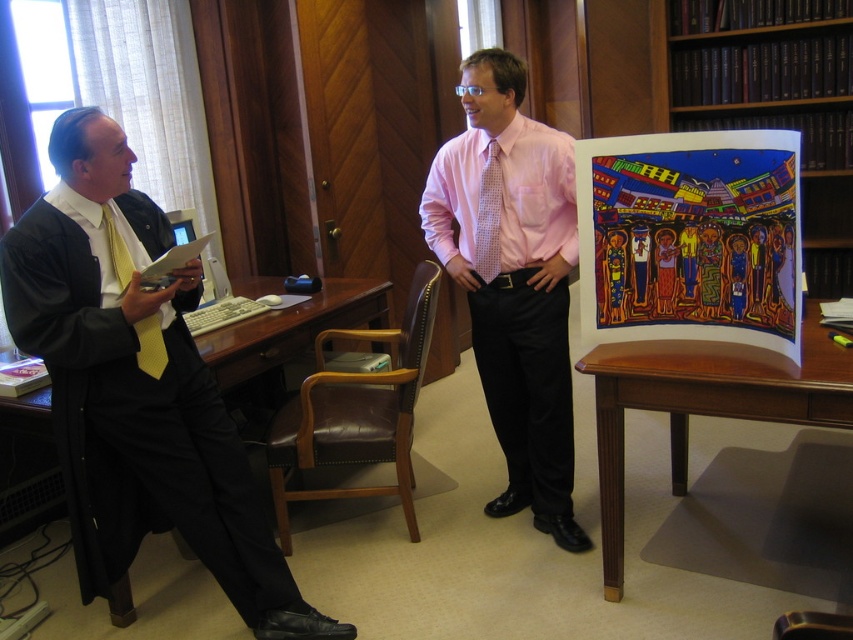
You are a photographer trying to capture a photo of both the seated man and the artwork. You want to ensure that both subjects are in focus. Given the positions of point 1 at coordinates point (827, 394) and point 2 at coordinates point (497, 140), which point should you focus on to achieve this?

You should focus on point (827, 394) because it is closer to the viewer than point (497, 140), ensuring both subjects are within the depth of field.

You are standing in the office scene and want to reach the point marked as point (100, 458). If your walking speed is 3 feet per second, how many seconds will it take you to reach that point?

The distance between point (100, 458) and the viewer is 6.90 feet. At a speed of 3 feet per second, it will take 6.90 divided by 3 equals approximately 2.3 seconds to reach the point.

You are an office assistant who needs to deliver a message to the person wearing the pink textured dress shirt at center. The message must be placed on the desk where the matte black suit at left is sitting. Can you reach the desk without moving past the artwork table?

The matte black suit at left is located below the pink textured dress shirt at center, which suggests the desk is positioned lower or behind. Since the artwork table is between them, you might need to navigate around it to reach the desk without obstruction.